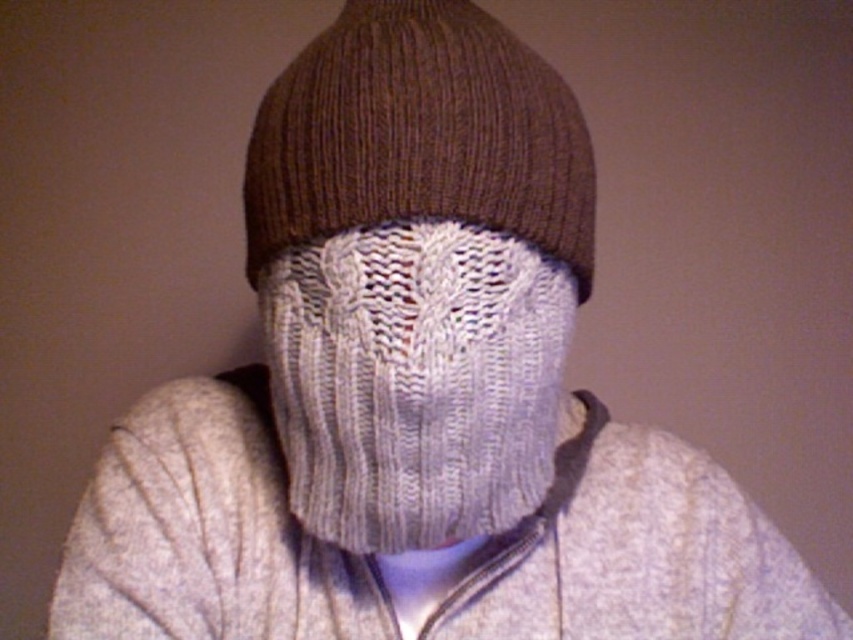
Question: Which point is farther from the camera taking this photo?

Choices:
 (A) pos(554,308)
 (B) pos(474,88)

Answer: (A)

Question: Is the position of white knitted scarf at center more distant than that of brown knitted hat at upper center?

Choices:
 (A) no
 (B) yes

Answer: (B)

Question: Does white knitted scarf at center have a larger size compared to brown knitted hat at upper center?

Choices:
 (A) yes
 (B) no

Answer: (A)

Question: Is white knitted scarf at center behind brown knitted hat at upper center?

Choices:
 (A) yes
 (B) no

Answer: (A)